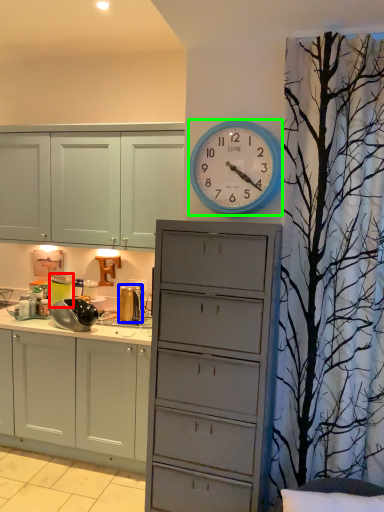
Question: Which object is the closest to the appliance (highlighted by a red box)? Choose among these: appliance (highlighted by a blue box) or wall clock (highlighted by a green box).

Choices:
 (A) appliance
 (B) wall clock

Answer: (A)